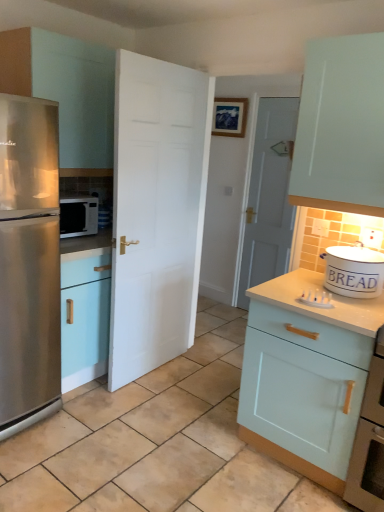
Find the location of a particular element. Image resolution: width=384 pixels, height=512 pixels. free space in front of white matte door at center, which ranks as the 2th door in right-to-left order is located at coordinates (145, 412).